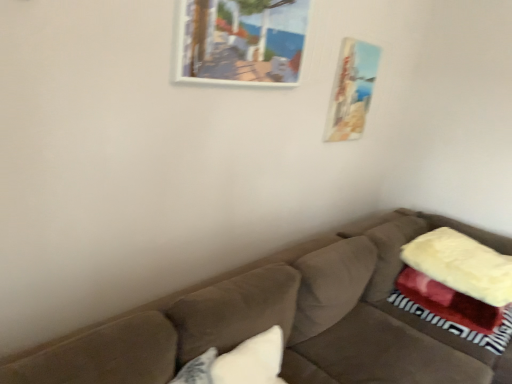
Question: Should I look upward or downward to see white soft pillow at lower center?

Choices:
 (A) up
 (B) down

Answer: (B)

Question: From a real-world perspective, is white soft pillow at lower center below wooden picture frame at upper center, the 2th picture frame in the back-to-front sequence?

Choices:
 (A) no
 (B) yes

Answer: (B)

Question: Does white soft pillow at lower center turn towards wooden picture frame at upper center, acting as the 2th picture frame starting from the right?

Choices:
 (A) no
 (B) yes

Answer: (A)

Question: Is white soft pillow at lower center wider than wooden picture frame at upper center, the 2th picture frame in the back-to-front sequence?

Choices:
 (A) no
 (B) yes

Answer: (B)

Question: From a real-world perspective, is white soft pillow at lower center on wooden picture frame at upper center, acting as the 2th picture frame starting from the right?

Choices:
 (A) yes
 (B) no

Answer: (B)

Question: From the image's perspective, does white soft pillow at lower center appear higher than wooden picture frame at upper center, placed as the first picture frame when sorted from front to back?

Choices:
 (A) no
 (B) yes

Answer: (A)

Question: From the image's perspective, does white soft pillow at lower center appear lower than wooden picture frame at upper center, acting as the 2th picture frame starting from the right?

Choices:
 (A) yes
 (B) no

Answer: (A)

Question: Is wooden picture frame at upper center, which appears as the first picture frame when viewed from the left, shorter than matte wooden picture frame at upper right, the 1th picture frame in the back-to-front sequence?

Choices:
 (A) yes
 (B) no

Answer: (A)

Question: Is wooden picture frame at upper center, which appears as the first picture frame when viewed from the left, facing away from matte wooden picture frame at upper right, the first picture frame from the right?

Choices:
 (A) yes
 (B) no

Answer: (B)

Question: From the image's perspective, is wooden picture frame at upper center, the 2th picture frame in the back-to-front sequence, above matte wooden picture frame at upper right, the first picture frame from the right?

Choices:
 (A) no
 (B) yes

Answer: (B)

Question: Could you tell me if wooden picture frame at upper center, which appears as the first picture frame when viewed from the left, is turned towards matte wooden picture frame at upper right, which is counted as the 2th picture frame, starting from the front?

Choices:
 (A) yes
 (B) no

Answer: (B)

Question: Can you confirm if wooden picture frame at upper center, the 2th picture frame in the back-to-front sequence, is bigger than matte wooden picture frame at upper right, the second picture frame in the left-to-right sequence?

Choices:
 (A) no
 (B) yes

Answer: (B)

Question: Can you see wooden picture frame at upper center, acting as the 2th picture frame starting from the right, touching matte wooden picture frame at upper right, the second picture frame in the left-to-right sequence?

Choices:
 (A) yes
 (B) no

Answer: (B)

Question: From a real-world perspective, is matte wooden picture frame at upper right, the second picture frame in the left-to-right sequence, below suede brown couch at center?

Choices:
 (A) no
 (B) yes

Answer: (A)